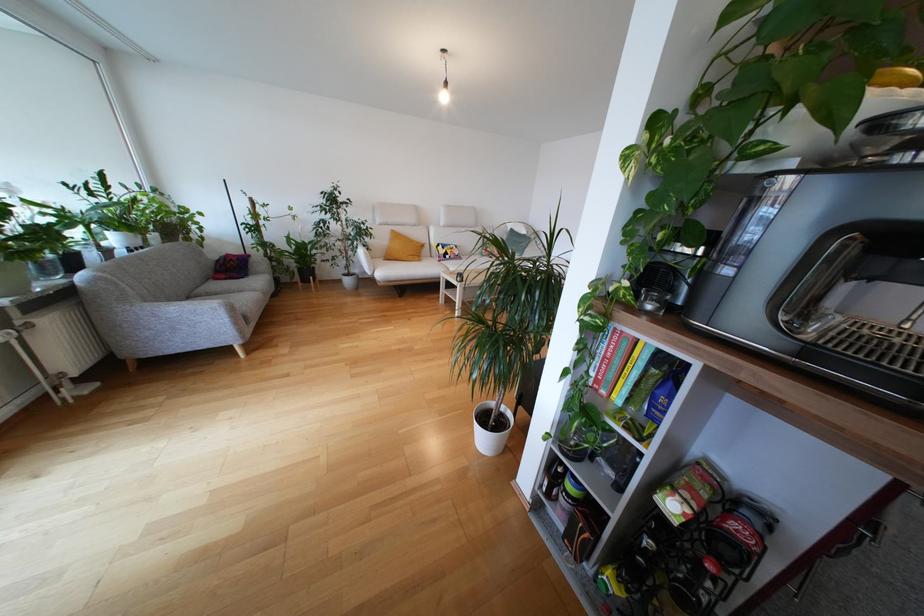
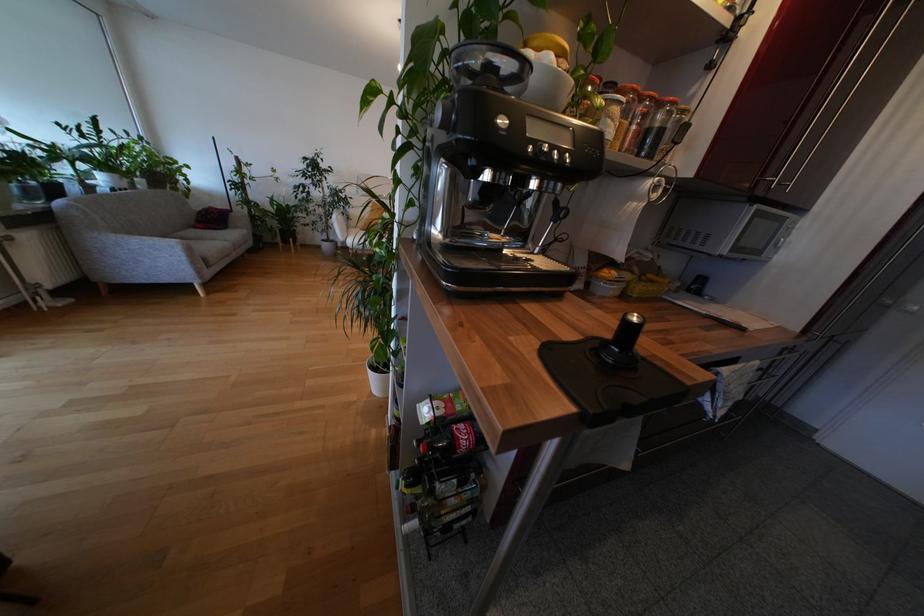
Question: In a continuous first-person perspective shot, in which direction is the camera moving?

Choices:
 (A) Left
 (B) Right
 (C) Forward
 (D) Backward

Answer: (B)